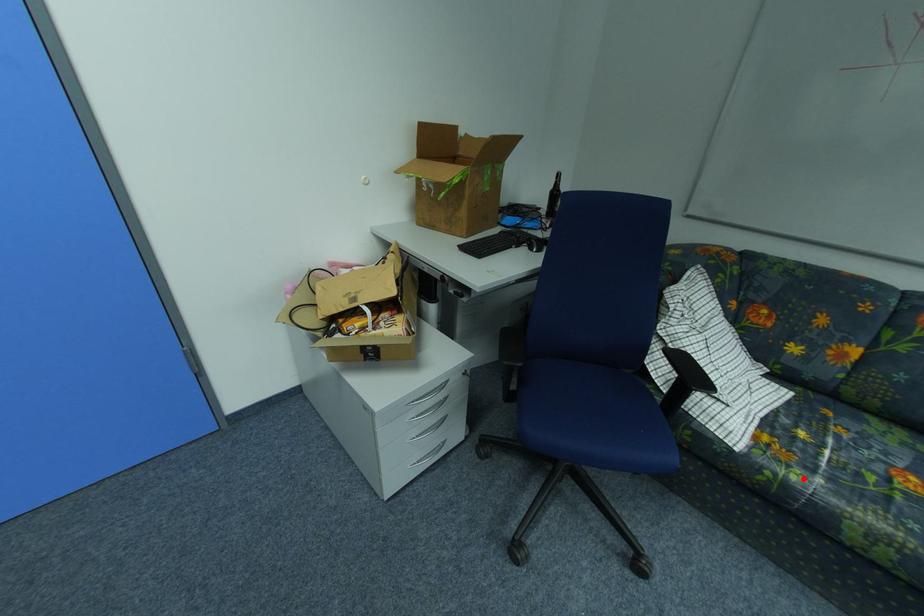
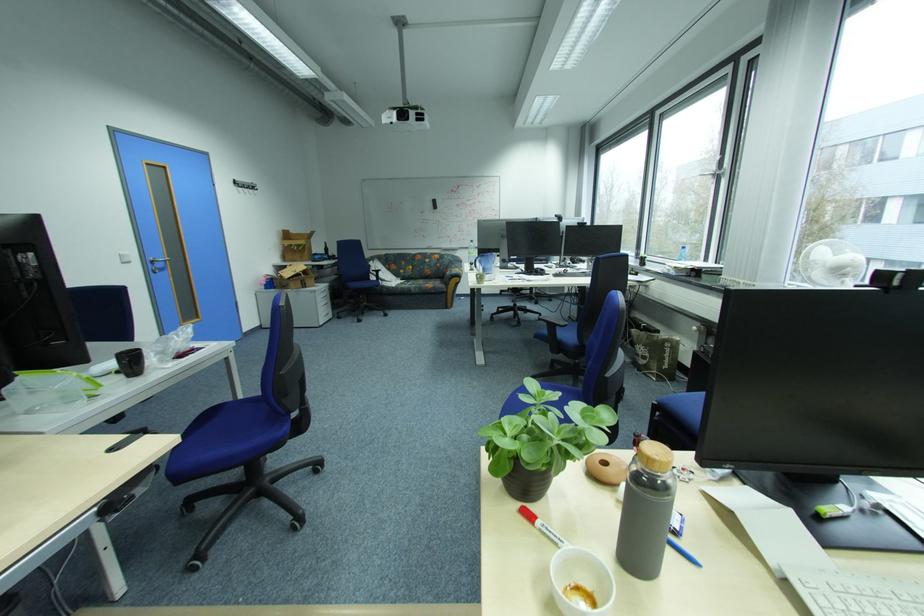
Question: I am providing you with two images of the same scene from different viewpoints. Given a red point in image1, look at the same physical point in image2. Is it:

Choices:
 (A) Closer to the viewpoint
 (B) Farther from the viewpoint

Answer: (A)